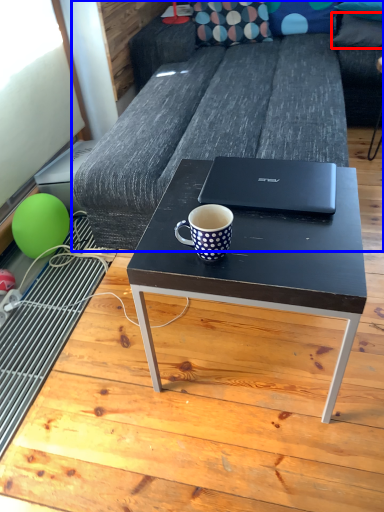
Question: Among these objects, which one is farthest to the camera, pillow (highlighted by a red box) or studio couch (highlighted by a blue box)?

Choices:
 (A) pillow
 (B) studio couch

Answer: (A)